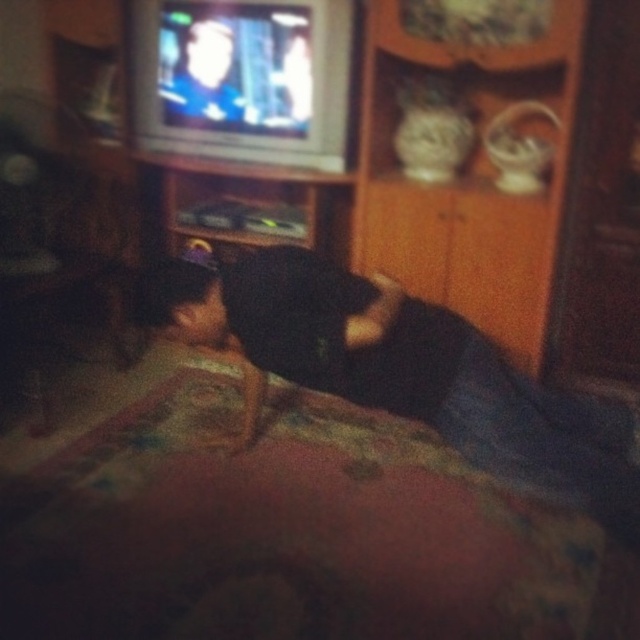
Can you confirm if dark fabric at center is positioned below smooth skin man at upper center?

Yes, dark fabric at center is below smooth skin man at upper center.

Which is behind, point (481, 442) or point (173, 96)?

The point (173, 96) is more distant.

Does point (248, 307) come in front of point (227, 68)?

Yes, it is in front of point (227, 68).

The image size is (640, 640). Identify the location of dark fabric at center. (396, 369).